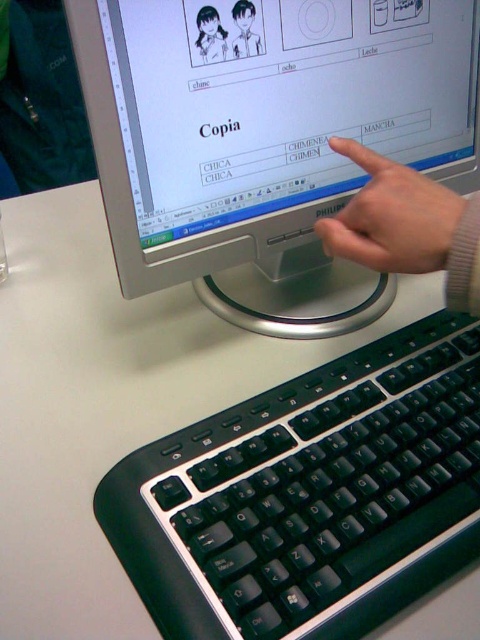
Question: Which object is closer to the camera taking this photo?

Choices:
 (A) satin silver monitor at center
 (B) black plastic keyboard at lower center
 (C) matte black character at upper left

Answer: (B)

Question: Does satin silver monitor at center have a smaller size compared to matte black character at upper center?

Choices:
 (A) no
 (B) yes

Answer: (A)

Question: Which of these objects is positioned farthest from the flesh-toned skin at upper center?

Choices:
 (A) satin silver monitor at center
 (B) black plastic keyboard at lower center
 (C) matte black character at upper center
 (D) matte black character at upper left

Answer: (D)

Question: Is satin silver monitor at center smaller than matte black character at upper center?

Choices:
 (A) no
 (B) yes

Answer: (A)

Question: Where is satin silver monitor at center located in relation to flesh-toned skin at upper center in the image?

Choices:
 (A) right
 (B) left

Answer: (B)

Question: Which of the following is the farthest from the observer?

Choices:
 (A) (432, 12)
 (B) (340, 227)

Answer: (A)